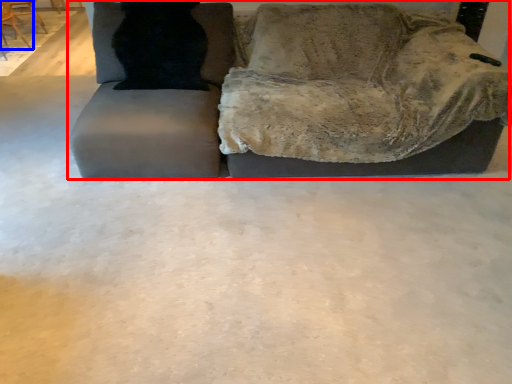
Question: Which object is further to the camera taking this photo, studio couch (highlighted by a red box) or chair (highlighted by a blue box)?

Choices:
 (A) studio couch
 (B) chair

Answer: (B)